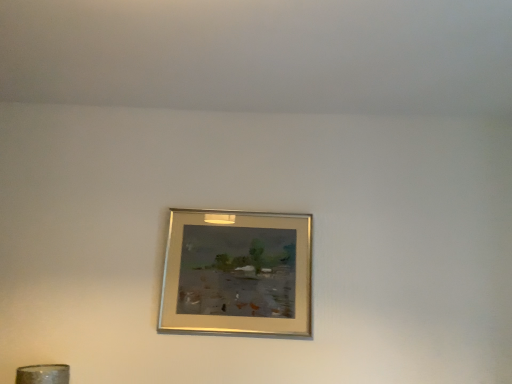
This screenshot has height=384, width=512. What are the coordinates of `gold metallic picture frame at center` in the screenshot? It's located at (237, 273).

The image size is (512, 384). Describe the element at coordinates (237, 273) in the screenshot. I see `gold metallic picture frame at center` at that location.

Where is `gold metallic picture frame at center`? Image resolution: width=512 pixels, height=384 pixels. gold metallic picture frame at center is located at coordinates (237, 273).